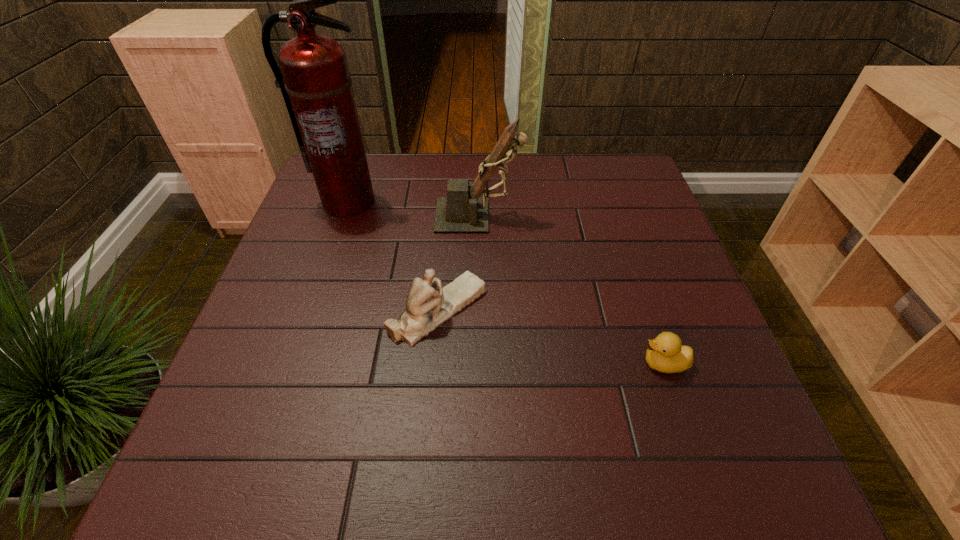
Where is `vacant space that's between the shorter figurine and the duckling`? vacant space that's between the shorter figurine and the duckling is located at coordinates coord(551,336).

Where is `vacant space that's between the rightmost object and the farther figurine`? vacant space that's between the rightmost object and the farther figurine is located at coordinates (571, 289).

This screenshot has width=960, height=540. In order to click on vacant space in between the fire extinguisher and the nearest object in this screenshot , I will do `click(506, 282)`.

Locate which object is the closest to the shortest object. Please provide its 2D coordinates. Your answer should be formatted as a tuple, i.e. [(x, y)], where the tuple contains the x and y coordinates of a point satisfying the conditions above.

[(428, 305)]

This screenshot has height=540, width=960. What are the coordinates of `the closest object to the nearer figurine` in the screenshot? It's located at (463, 210).